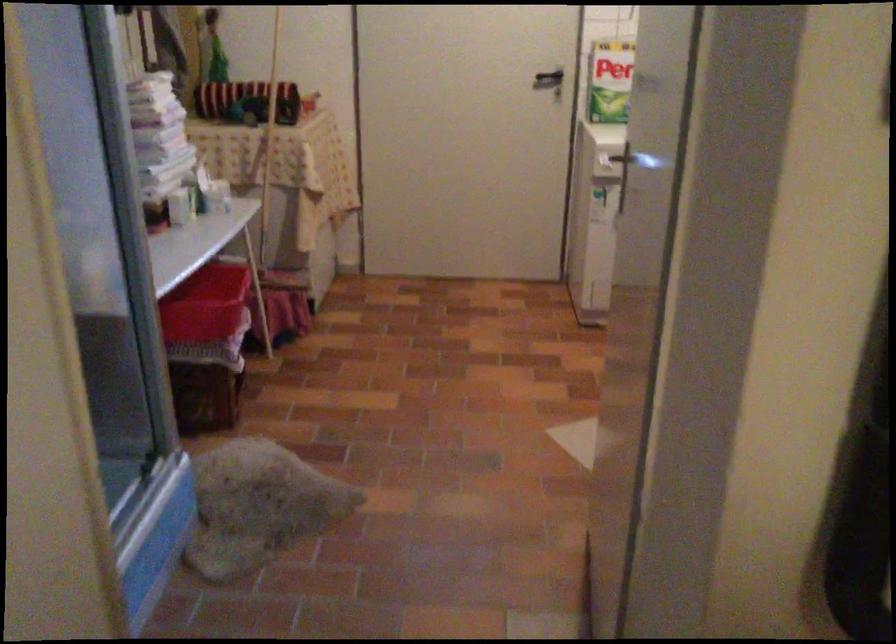
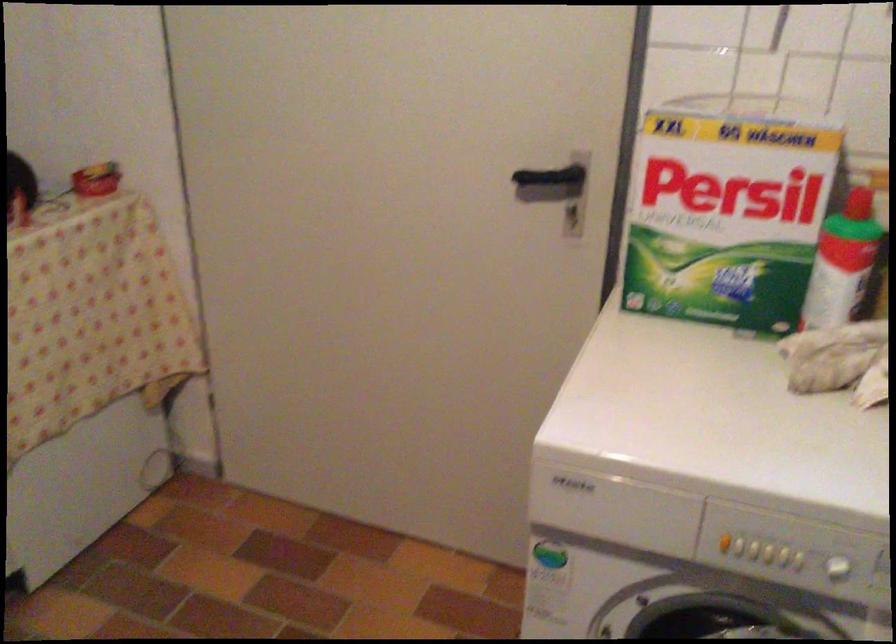
Where in the second image is the point corresponding to point 545,73 from the first image?

(553, 180)